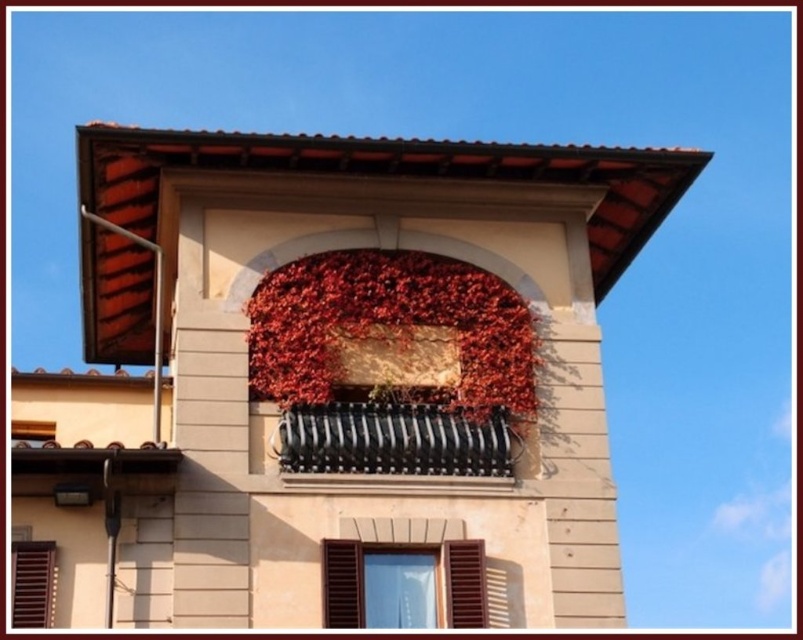
Question: Estimate the real-world distances between objects in this image. Which object is closer to the black metal railing at center?

Choices:
 (A) brown wooden shutter at lower left
 (B) matte brown shutter at lower center
 (C) dried red leaves at center

Answer: (C)

Question: Can you confirm if dried red leaves at center is positioned above matte brown shutter at lower center?

Choices:
 (A) no
 (B) yes

Answer: (B)

Question: Which object is the closest to the matte brown shutter at lower center?

Choices:
 (A) brown wooden shutter at lower left
 (B) dried red leaves at center
 (C) matte black window box at upper center
 (D) black metal railing at center

Answer: (D)

Question: Can you confirm if matte brown shutter at lower center is wider than matte black window box at upper center?

Choices:
 (A) yes
 (B) no

Answer: (A)

Question: Which of the following is the farthest from the observer?

Choices:
 (A) dried red leaves at center
 (B) matte black window box at upper center
 (C) brown wooden shutter at lower left
 (D) matte brown shutter at lower center

Answer: (A)

Question: Is matte brown shutter at lower center wider than matte black window box at upper center?

Choices:
 (A) no
 (B) yes

Answer: (B)